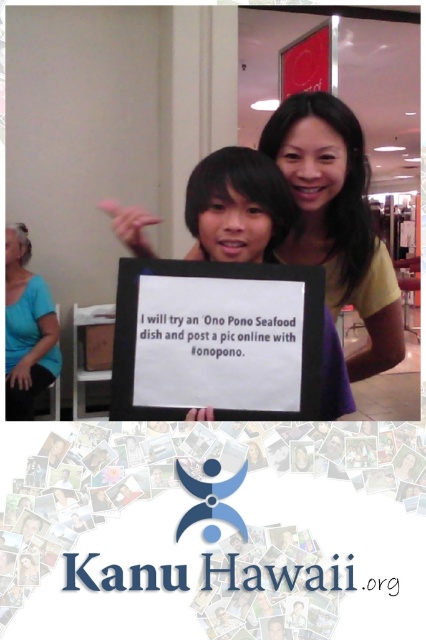
You are a photographer at the mall and need to capture a clear shot of both the white paper sign at center and the blue fabric shirt at left. Which object should you focus on first to ensure it appears larger in the photo?

You should focus on the blue fabric shirt at left first because it occupies more space than the white paper sign at center, making it naturally larger in the photo.